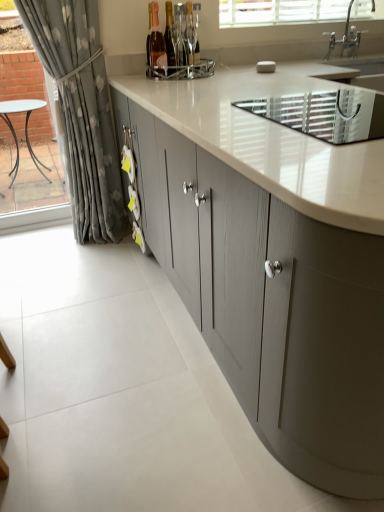
What is the approximate width of pink glass bottle at upper center, placed as the 1th bottle when sorted from left to right?

It is 3.03 inches.

Measure the distance between clear glass window frame at left and camera.

The depth of clear glass window frame at left is 11.47 feet.

This screenshot has width=384, height=512. Describe the element at coordinates (32, 149) in the screenshot. I see `clear glass window frame at left` at that location.

What do you see at coordinates (170, 40) in the screenshot? The width and height of the screenshot is (384, 512). I see `matte glass bottle at center, positioned as the 2th bottle in left-to-right order` at bounding box center [170, 40].

Identify the location of white textured sink at upper right. (325, 114).

The height and width of the screenshot is (512, 384). In order to click on gray floral fabric curtain at left in this screenshot , I will do `click(81, 112)`.

Measure the distance between point (187,50) and camera.

The distance of point (187,50) from camera is 6.80 feet.

Image resolution: width=384 pixels, height=512 pixels. I want to click on pink glass bottle at upper center, which is counted as the third bottle, starting from the right, so click(156, 45).

Which is more distant, (166, 54) or (77, 92)?

The point (77, 92) is more distant.

From the image's perspective, would you say pink glass bottle at upper center, which is counted as the third bottle, starting from the right, is positioned over gray floral fabric curtain at left?

Yes, from the image's perspective, pink glass bottle at upper center, which is counted as the third bottle, starting from the right, is above gray floral fabric curtain at left.

Is pink glass bottle at upper center, placed as the 1th bottle when sorted from left to right, beside gray floral fabric curtain at left?

No, pink glass bottle at upper center, placed as the 1th bottle when sorted from left to right, is not making contact with gray floral fabric curtain at left.

Looking at the image, does pink glass bottle at upper center, which is counted as the third bottle, starting from the right, seem bigger or smaller compared to gray floral fabric curtain at left?

In the image, pink glass bottle at upper center, which is counted as the third bottle, starting from the right, appears to be smaller than gray floral fabric curtain at left.

From the image's perspective, between silver metallic faucet at upper right and white textured blinds at upper center, which one is located above?

From the image's view, white textured blinds at upper center is above.

In the scene shown: Is silver metallic faucet at upper right in contact with white textured blinds at upper center?

No, silver metallic faucet at upper right is not beside white textured blinds at upper center.

From a real-world perspective, which is physically above, silver metallic faucet at upper right or white textured blinds at upper center?

In real-world perspective, white textured blinds at upper center is above.

How far apart are silver metallic faucet at upper right and white textured blinds at upper center?

A distance of 8.82 inches exists between silver metallic faucet at upper right and white textured blinds at upper center.

Considering the relative sizes of white textured sink at upper right and pink glass bottle at upper center, which is counted as the third bottle, starting from the right, in the image provided, is white textured sink at upper right thinner than pink glass bottle at upper center, which is counted as the third bottle, starting from the right,?

No, white textured sink at upper right is not thinner than pink glass bottle at upper center, which is counted as the third bottle, starting from the right.

Considering the sizes of objects white textured sink at upper right and pink glass bottle at upper center, which is counted as the third bottle, starting from the right, in the image provided, who is bigger, white textured sink at upper right or pink glass bottle at upper center, which is counted as the third bottle, starting from the right,?

white textured sink at upper right is bigger.

Looking at this image, who is taller, white textured sink at upper right or pink glass bottle at upper center, which is counted as the third bottle, starting from the right?

pink glass bottle at upper center, which is counted as the third bottle, starting from the right, is taller.

Could you tell me if white textured sink at upper right is turned towards pink glass bottle at upper center, which is counted as the third bottle, starting from the right?

No, white textured sink at upper right is not aimed at pink glass bottle at upper center, which is counted as the third bottle, starting from the right.

Which of these two, matte glass bottle at center, which appears as the second bottle when viewed from the right, or clear glass window frame at left, is bigger?

clear glass window frame at left is bigger.

From the image's perspective, which one is positioned lower, matte glass bottle at center, which appears as the second bottle when viewed from the right, or clear glass window frame at left?

clear glass window frame at left, from the image's perspective.

Is matte glass bottle at center, which appears as the second bottle when viewed from the right, oriented towards clear glass window frame at left?

No, matte glass bottle at center, which appears as the second bottle when viewed from the right, is not facing towards clear glass window frame at left.

From the image's perspective, which object appears higher, white textured blinds at upper center or silver metallic faucet at upper right?

white textured blinds at upper center.

Which object is positioned more to the right, white textured blinds at upper center or silver metallic faucet at upper right?

Positioned to the right is silver metallic faucet at upper right.

The width and height of the screenshot is (384, 512). What are the coordinates of `tap below the white textured blinds at upper center (from a real-world perspective)` in the screenshot? It's located at (345, 38).

Looking at the image, does white textured blinds at upper center seem bigger or smaller compared to silver metallic faucet at upper right?

white textured blinds at upper center is bigger than silver metallic faucet at upper right.

Is silver metallic faucet at upper right at the right side of matte glass bottle at center, which is the third bottle from left to right?

Yes, silver metallic faucet at upper right is to the right of matte glass bottle at center, which is the third bottle from left to right.

Considering the relative sizes of silver metallic faucet at upper right and matte glass bottle at center, which is the third bottle from left to right, in the image provided, is silver metallic faucet at upper right thinner than matte glass bottle at center, which is the third bottle from left to right,?

No, silver metallic faucet at upper right is not thinner than matte glass bottle at center, which is the third bottle from left to right.

Is matte glass bottle at center, which is the third bottle from left to right, at the back of silver metallic faucet at upper right?

silver metallic faucet at upper right does not have its back to matte glass bottle at center, which is the third bottle from left to right.

Can you confirm if silver metallic faucet at upper right is taller than matte glass bottle at center, which is the third bottle from left to right?

No, silver metallic faucet at upper right is not taller than matte glass bottle at center, which is the third bottle from left to right.

In the image, there is a pink glass bottle at upper center, placed as the 1th bottle when sorted from left to right. Where is `window frame below it (from a real-world perspective)`? The image size is (384, 512). window frame below it (from a real-world perspective) is located at coordinates (32, 149).

Considering the positions of objects pink glass bottle at upper center, which is counted as the third bottle, starting from the right, and clear glass window frame at left in the image provided, who is behind, pink glass bottle at upper center, which is counted as the third bottle, starting from the right, or clear glass window frame at left?

clear glass window frame at left is more distant.

Are pink glass bottle at upper center, which is counted as the third bottle, starting from the right, and clear glass window frame at left located far from each other?

Absolutely, pink glass bottle at upper center, which is counted as the third bottle, starting from the right, is distant from clear glass window frame at left.

From the image's perspective, which bottle is the 1st one above the gray floral fabric curtain at left? Please provide its 2D coordinates.

[(156, 45)]

Where is `tap located below the white textured blinds at upper center (from the image's perspective)`? The width and height of the screenshot is (384, 512). tap located below the white textured blinds at upper center (from the image's perspective) is located at coordinates pyautogui.click(x=345, y=38).

When comparing their distances from pink glass bottle at upper center, placed as the 1th bottle when sorted from left to right, does silver metallic faucet at upper right or matte gray cabinets at center seem closer?

Based on the image, matte gray cabinets at center appears to be nearer to pink glass bottle at upper center, placed as the 1th bottle when sorted from left to right.

Looking at the image, which one is located further to matte gray cabinets at center, clear glass window frame at left or silver metallic faucet at upper right?

Based on the image, clear glass window frame at left appears to be further to matte gray cabinets at center.

Which object lies further to the anchor point white textured sink at upper right, matte glass bottle at center, positioned as the 2th bottle in left-to-right order, or clear glass window frame at left?

Among the two, clear glass window frame at left is located further to white textured sink at upper right.

From the image, which object appears to be farther from silver metallic faucet at upper right, white textured sink at upper right or gray floral fabric curtain at left?

gray floral fabric curtain at left.

Which object lies further to the anchor point white textured blinds at upper center, clear glass window frame at left or silver metallic faucet at upper right?

Among the two, clear glass window frame at left is located further to white textured blinds at upper center.

From the picture: Estimate the real-world distances between objects in this image. Which object is further from clear glass window frame at left, white textured blinds at upper center or white textured sink at upper right?

white textured sink at upper right lies further to clear glass window frame at left than the other object.

In the scene shown: Looking at the image, which one is located closer to clear glass window frame at left, matte gray cabinets at center or silver metallic faucet at upper right?

matte gray cabinets at center.

When comparing their distances from matte glass bottle at center, which is the third bottle from left to right, does matte glass bottle at center, positioned as the 2th bottle in left-to-right order, or white textured blinds at upper center seem further?

Among the two, white textured blinds at upper center is located further to matte glass bottle at center, which is the third bottle from left to right.

Where is `curtain between clear glass window frame at left and white textured sink at upper right from left to right`? The image size is (384, 512). curtain between clear glass window frame at left and white textured sink at upper right from left to right is located at coordinates (81, 112).

Find the location of a particular element. Image resolution: width=384 pixels, height=512 pixels. bay window situated between matte glass bottle at center, positioned as the 2th bottle in left-to-right order, and silver metallic faucet at upper right from left to right is located at coordinates (279, 12).

You are a GUI agent. You are given a task and a screenshot of the screen. Output one action in this format:
    pyautogui.click(x=<x>, y=<y>)
    Task: Click on the curtain located between clear glass window frame at left and white textured blinds at upper center in the left-right direction
    The image size is (384, 512).
    Given the screenshot: What is the action you would take?
    pyautogui.click(x=81, y=112)

Where is `appliance located between gray floral fabric curtain at left and silver metallic faucet at upper right in the left-right direction`? appliance located between gray floral fabric curtain at left and silver metallic faucet at upper right in the left-right direction is located at coordinates (325, 114).